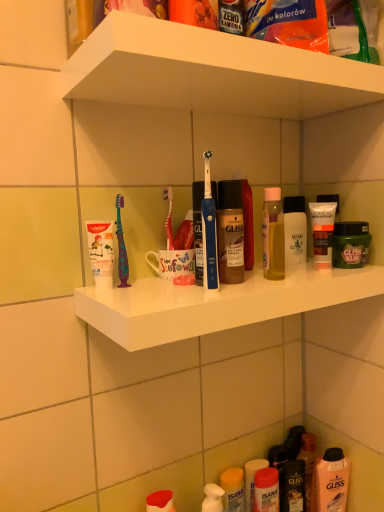
This screenshot has width=384, height=512. I want to click on green matte hair mask at right, which ranks as the fourth toiletry in left-to-right order, so coord(350,244).

Describe the element at coordinates (209, 232) in the screenshot. The image size is (384, 512). I see `blue plastic toothbrush at center` at that location.

What do you see at coordinates (101, 252) in the screenshot?
I see `white matte toothpaste tube at left, placed as the first toiletry when sorted from left to right` at bounding box center [101, 252].

Locate an element on the screen. white plastic shelf at upper center, which is the first supermarket shelf from top to bottom is located at coordinates (212, 72).

At what (x,y) coordinates should I click in order to perform the action: click on white plastic shelf at upper center, positioned as the 2th supermarket shelf in top-to-bottom order. Please return your answer as a coordinate pair (x, y). Looking at the image, I should click on (216, 303).

Find the location of a particular element. The image size is (384, 512). matte yellow lotion at lower center, placed as the 2th toiletry when sorted from left to right is located at coordinates (233, 489).

This screenshot has height=512, width=384. Identify the location of green matte hair mask at right, marked as the first toiletry in a right-to-left arrangement. (350, 244).

From the image's perspective, is matte yellow lotion at lower center, arranged as the 3th toiletry when viewed from the right, located above white matte tube at right, which appears as the 1th toiletry when viewed from the top?

No, from the image's perspective, matte yellow lotion at lower center, arranged as the 3th toiletry when viewed from the right, is not on top of white matte tube at right, which appears as the 1th toiletry when viewed from the top.

Which toiletry is the 1st one when counting from the right side of the matte yellow lotion at lower center, arranged as the 3th toiletry when viewed from the right? Please provide its 2D coordinates.

[(322, 232)]

Is matte yellow lotion at lower center, arranged as the 3th toiletry when viewed from the right, bigger than white matte tube at right, which ranks as the 2th toiletry in right-to-left order?

Yes.

Is there a large distance between matte yellow lotion at lower center, placed as the 2th toiletry when sorted from left to right, and white plastic shelf at upper center, acting as the 2th supermarket shelf starting from the bottom?

No.

Is matte yellow lotion at lower center, placed as the 2th toiletry when sorted from left to right, to the right of white plastic shelf at upper center, acting as the 2th supermarket shelf starting from the bottom, from the viewer's perspective?

Yes, matte yellow lotion at lower center, placed as the 2th toiletry when sorted from left to right, is to the right of white plastic shelf at upper center, acting as the 2th supermarket shelf starting from the bottom.

Which of these two, matte yellow lotion at lower center, the first toiletry ordered from the bottom, or white plastic shelf at upper center, acting as the 2th supermarket shelf starting from the bottom, is bigger?

white plastic shelf at upper center, acting as the 2th supermarket shelf starting from the bottom, is bigger.

From a real-world perspective, is matte yellow lotion at lower center, arranged as the 3th toiletry when viewed from the right, on white plastic shelf at upper center, which is the first supermarket shelf from top to bottom?

Incorrect, from a real-world perspective, matte yellow lotion at lower center, arranged as the 3th toiletry when viewed from the right, is lower than white plastic shelf at upper center, which is the first supermarket shelf from top to bottom.

Considering the positions of objects matte yellow lotion at lower center, arranged as the 3th toiletry when viewed from the right, and white matte toothpaste tube at left, positioned as the 2th toiletry in bottom-to-top order, in the image provided, who is behind, matte yellow lotion at lower center, arranged as the 3th toiletry when viewed from the right, or white matte toothpaste tube at left, positioned as the 2th toiletry in bottom-to-top order,?

matte yellow lotion at lower center, arranged as the 3th toiletry when viewed from the right, is further from the camera.

From the image's perspective, is matte yellow lotion at lower center, the first toiletry ordered from the bottom, on white matte toothpaste tube at left, which is the 3th toiletry from top to bottom?

Incorrect, from the image's perspective, matte yellow lotion at lower center, the first toiletry ordered from the bottom, is lower than white matte toothpaste tube at left, which is the 3th toiletry from top to bottom.

Does matte yellow lotion at lower center, the fourth toiletry when ordered from top to bottom, turn towards white matte toothpaste tube at left, which is the 3th toiletry from top to bottom?

No.

Is point (222, 487) farther from viewer compared to point (105, 243)?

Yes.

Is matte yellow lotion at lower center, the fourth toiletry when ordered from top to bottom, at the right side of translucent plastic mouthwash at lower right?

No, matte yellow lotion at lower center, the fourth toiletry when ordered from top to bottom, is not to the right of translucent plastic mouthwash at lower right.

From a real-world perspective, is matte yellow lotion at lower center, the fourth toiletry when ordered from top to bottom, located beneath translucent plastic mouthwash at lower right?

Yes, from a real-world perspective, matte yellow lotion at lower center, the fourth toiletry when ordered from top to bottom, is beneath translucent plastic mouthwash at lower right.

From the translucent plastic mouthwash at lower right, count the 2nd toiletry to the left and point to it. Please provide its 2D coordinates.

[(233, 489)]

Is matte yellow lotion at lower center, the fourth toiletry when ordered from top to bottom, bigger than translucent plastic mouthwash at lower right?

No.

Is blue plastic toothbrush at center shorter than white matte toothpaste tube at left, positioned as the 2th toiletry in bottom-to-top order?

No.

From a real-world perspective, is blue plastic toothbrush at center under white matte toothpaste tube at left, which is the 3th toiletry from top to bottom?

Actually, blue plastic toothbrush at center is physically above white matte toothpaste tube at left, which is the 3th toiletry from top to bottom, in the real world.

Is blue plastic toothbrush at center directly adjacent to white matte toothpaste tube at left, positioned as the 2th toiletry in bottom-to-top order?

There is a gap between blue plastic toothbrush at center and white matte toothpaste tube at left, positioned as the 2th toiletry in bottom-to-top order.

From a real-world perspective, is white matte toothpaste tube at left, placed as the first toiletry when sorted from left to right, on top of white matte tube at right, the fourth toiletry in the bottom-to-top sequence?

No.

Which is behind, point (111, 266) or point (321, 265)?

The point (321, 265) is behind.

Considering the sizes of objects white matte toothpaste tube at left, which is the 3th toiletry from top to bottom, and white matte tube at right, the fourth toiletry in the bottom-to-top sequence, in the image provided, who is shorter, white matte toothpaste tube at left, which is the 3th toiletry from top to bottom, or white matte tube at right, the fourth toiletry in the bottom-to-top sequence,?

Standing shorter between the two is white matte toothpaste tube at left, which is the 3th toiletry from top to bottom.

Which of these two, green matte hair mask at right, which is the third toiletry from bottom to top, or white plastic shelf at upper center, the 1th supermarket shelf positioned from the bottom, is wider?

Wider between the two is white plastic shelf at upper center, the 1th supermarket shelf positioned from the bottom.

Between green matte hair mask at right, marked as the first toiletry in a right-to-left arrangement, and white plastic shelf at upper center, the 1th supermarket shelf positioned from the bottom, which one has more height?

green matte hair mask at right, marked as the first toiletry in a right-to-left arrangement.

From a real-world perspective, which object stands above the other?

green matte hair mask at right, marked as the first toiletry in a right-to-left arrangement, is physically above.

Consider the image. Is white plastic shelf at upper center, the 1th supermarket shelf positioned from the bottom, inside green matte hair mask at right, which ranks as the fourth toiletry in left-to-right order?

That's incorrect, white plastic shelf at upper center, the 1th supermarket shelf positioned from the bottom, is not inside green matte hair mask at right, which ranks as the fourth toiletry in left-to-right order.

This screenshot has width=384, height=512. I want to click on the 1st toiletry to the right of the matte yellow lotion at lower center, arranged as the 3th toiletry when viewed from the right, starting your count from the anchor, so click(322, 232).

You are a GUI agent. You are given a task and a screenshot of the screen. Output one action in this format:
    pyautogui.click(x=<x>, y=<y>)
    Task: Click on the 4th toiletry below the white plastic shelf at upper center, acting as the 2th supermarket shelf starting from the bottom (from the image's perspective)
    The image size is (384, 512).
    Given the screenshot: What is the action you would take?
    pyautogui.click(x=233, y=489)

From the image, which object appears to be nearer to matte yellow lotion at lower center, the first toiletry ordered from the bottom, green matte hair mask at right, marked as the first toiletry in a right-to-left arrangement, or blue plastic toothbrush at center?

Among the two, green matte hair mask at right, marked as the first toiletry in a right-to-left arrangement, is located nearer to matte yellow lotion at lower center, the first toiletry ordered from the bottom.

Which object lies nearer to the anchor point blue plastic toothbrush at center, white matte tube at right, which ranks as the 2th toiletry in right-to-left order, or white matte toothpaste tube at left, which ranks as the fourth toiletry in right-to-left order?

white matte toothpaste tube at left, which ranks as the fourth toiletry in right-to-left order, is positioned closer to the anchor blue plastic toothbrush at center.

Which object lies further to the anchor point translucent plastic mouthwash at lower right, white plastic shelf at upper center, which is the first supermarket shelf from top to bottom, or matte yellow lotion at lower center, the first toiletry ordered from the bottom?

white plastic shelf at upper center, which is the first supermarket shelf from top to bottom, is further to translucent plastic mouthwash at lower right.

Looking at the image, which one is located further to blue plastic toothbrush at center, white matte toothpaste tube at left, which is the 3th toiletry from top to bottom, or white matte tube at right, the fourth toiletry in the bottom-to-top sequence?

white matte tube at right, the fourth toiletry in the bottom-to-top sequence, is further to blue plastic toothbrush at center.

Estimate the real-world distances between objects in this image. Which object is further from white plastic shelf at upper center, acting as the 2th supermarket shelf starting from the bottom, translucent plastic mouthwash at lower right or white plastic shelf at upper center, the 1th supermarket shelf positioned from the bottom?

translucent plastic mouthwash at lower right.

Considering their positions, is green matte hair mask at right, marked as the first toiletry in a right-to-left arrangement, positioned further to blue plastic toothbrush at center than matte yellow lotion at lower center, the fourth toiletry when ordered from top to bottom?

matte yellow lotion at lower center, the fourth toiletry when ordered from top to bottom, lies further to blue plastic toothbrush at center than the other object.

Looking at the image, which one is located closer to matte yellow lotion at lower center, arranged as the 3th toiletry when viewed from the right, white matte toothpaste tube at left, placed as the first toiletry when sorted from left to right, or white plastic shelf at upper center, which is the first supermarket shelf from top to bottom?

white matte toothpaste tube at left, placed as the first toiletry when sorted from left to right.

Consider the image. From the image, which object appears to be nearer to matte yellow lotion at lower center, placed as the 2th toiletry when sorted from left to right, green matte hair mask at right, which is the third toiletry from bottom to top, or white plastic shelf at upper center, which is the first supermarket shelf from top to bottom?

Based on the image, green matte hair mask at right, which is the third toiletry from bottom to top, appears to be nearer to matte yellow lotion at lower center, placed as the 2th toiletry when sorted from left to right.

The width and height of the screenshot is (384, 512). I want to click on toothbrush between white plastic shelf at upper center, which is the first supermarket shelf from top to bottom, and white matte tube at right, the fourth toiletry in the bottom-to-top sequence, from top to bottom, so click(x=209, y=232).

You are a GUI agent. You are given a task and a screenshot of the screen. Output one action in this format:
    pyautogui.click(x=<x>, y=<y>)
    Task: Click on the toothbrush between white plastic shelf at upper center, acting as the 2th supermarket shelf starting from the bottom, and matte yellow lotion at lower center, arranged as the 3th toiletry when viewed from the right, in the up-down direction
    Image resolution: width=384 pixels, height=512 pixels.
    Given the screenshot: What is the action you would take?
    pyautogui.click(x=209, y=232)

Where is `supermarket shelf that lies between white plastic shelf at upper center, acting as the 2th supermarket shelf starting from the bottom, and matte yellow lotion at lower center, the fourth toiletry when ordered from top to bottom, from top to bottom`? supermarket shelf that lies between white plastic shelf at upper center, acting as the 2th supermarket shelf starting from the bottom, and matte yellow lotion at lower center, the fourth toiletry when ordered from top to bottom, from top to bottom is located at coordinates (216, 303).

Locate an element on the screen. Image resolution: width=384 pixels, height=512 pixels. supermarket shelf that lies between blue plastic toothbrush at center and matte yellow lotion at lower center, the first toiletry ordered from the bottom, from top to bottom is located at coordinates (216, 303).